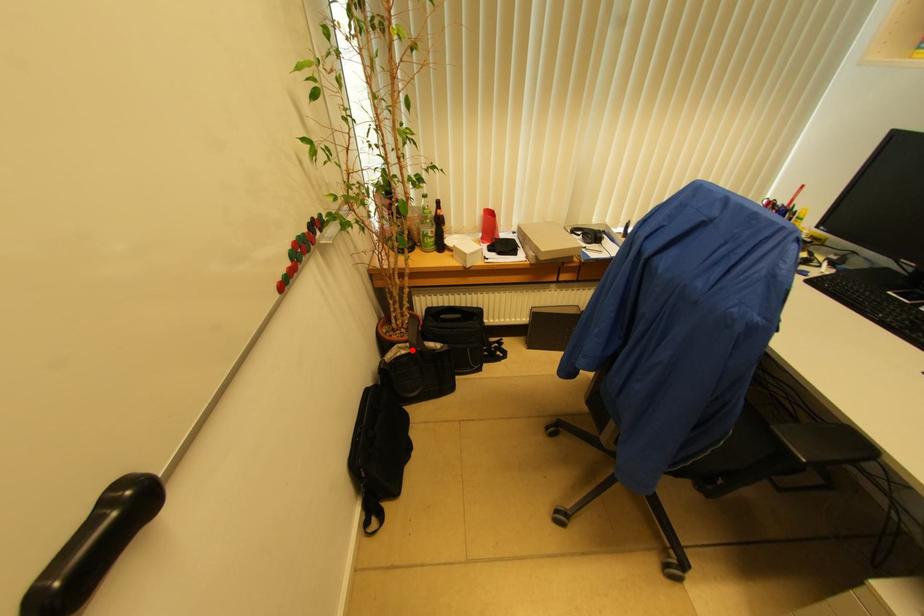
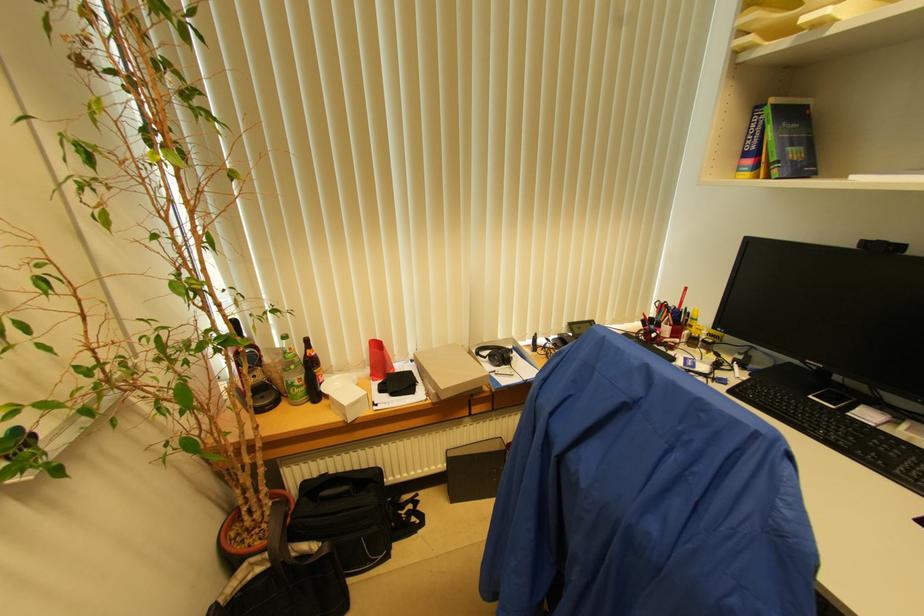
Where in the second image is the point corresponding to the highlighted location from the first image?

(273, 561)